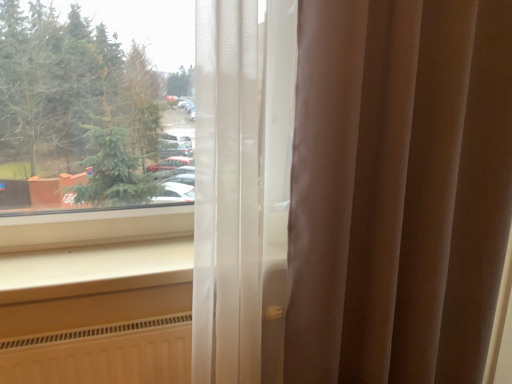
Question: Can you confirm if sheer white curtain at center is thinner than white smooth window sill at lower left?

Choices:
 (A) no
 (B) yes

Answer: (B)

Question: Does sheer white curtain at center have a larger size compared to white smooth window sill at lower left?

Choices:
 (A) yes
 (B) no

Answer: (A)

Question: Is sheer white curtain at center outside of white smooth window sill at lower left?

Choices:
 (A) yes
 (B) no

Answer: (A)

Question: Is sheer white curtain at center positioned far away from white smooth window sill at lower left?

Choices:
 (A) yes
 (B) no

Answer: (B)

Question: From the image's perspective, is sheer white curtain at center under white smooth window sill at lower left?

Choices:
 (A) yes
 (B) no

Answer: (B)

Question: Is sheer white curtain at center at the left side of white smooth window sill at lower left?

Choices:
 (A) yes
 (B) no

Answer: (B)

Question: From the image's perspective, is white smooth window sill at lower left below sheer white curtain at center?

Choices:
 (A) no
 (B) yes

Answer: (B)

Question: Is white smooth window sill at lower left turned away from sheer white curtain at center?

Choices:
 (A) yes
 (B) no

Answer: (B)

Question: Is white smooth window sill at lower left smaller than sheer white curtain at center?

Choices:
 (A) yes
 (B) no

Answer: (A)

Question: Can you see white smooth window sill at lower left touching sheer white curtain at center?

Choices:
 (A) no
 (B) yes

Answer: (A)

Question: Is white smooth window sill at lower left taller than sheer white curtain at center?

Choices:
 (A) yes
 (B) no

Answer: (B)

Question: Is white smooth window sill at lower left wider than sheer white curtain at center?

Choices:
 (A) yes
 (B) no

Answer: (A)

Question: Is point (290, 344) closer or farther from the camera than point (190, 248)?

Choices:
 (A) closer
 (B) farther

Answer: (A)